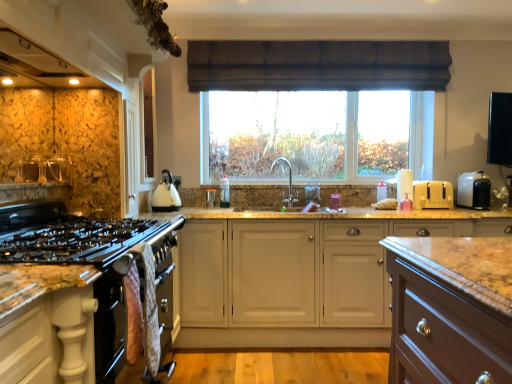
Question: Based on their sizes in the image, would you say granite countertop at lower left is bigger or smaller than white glossy kettle at center?

Choices:
 (A) small
 (B) big

Answer: (A)

Question: From their relative heights in the image, would you say granite countertop at lower left is taller or shorter than white glossy kettle at center?

Choices:
 (A) short
 (B) tall

Answer: (A)

Question: Estimate the real-world distances between objects in this image. Which object is farther from the black matte oven mitts at lower left, which is counted as the first cabinetry, starting from the left?

Choices:
 (A) white matte cabinet at center, which is the 1th cabinetry from back to front
 (B) satin nickel faucet at center
 (C) quilted fabric oven mitts at lower left
 (D) white plastic toaster at right, marked as the first appliance in a right-to-left arrangement
 (E) granite countertop at lower left

Answer: (D)

Question: Estimate the real-world distances between objects in this image. Which object is farther from the brown fabric curtain at upper center?

Choices:
 (A) white plastic toaster at right, marked as the first appliance in a right-to-left arrangement
 (B) white matte cabinet at center, positioned as the 1th cabinetry in right-to-left order
 (C) black glass gas stove at left
 (D) granite countertop at lower left
 (E) quilted fabric oven mitts at lower left

Answer: (E)